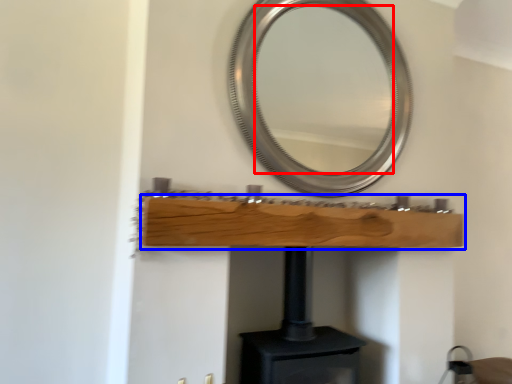
Question: Which point is further to the camera, mirror (highlighted by a red box) or shelf (highlighted by a blue box)?

Choices:
 (A) mirror
 (B) shelf

Answer: (A)